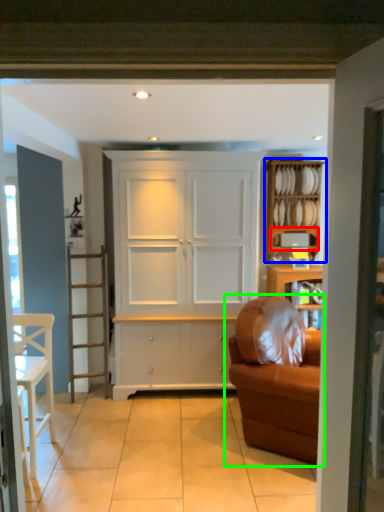
Question: Which object is the farthest from shelf (highlighted by a red box)? Choose among these: shelf (highlighted by a blue box) or studio couch (highlighted by a green box).

Choices:
 (A) shelf
 (B) studio couch

Answer: (B)